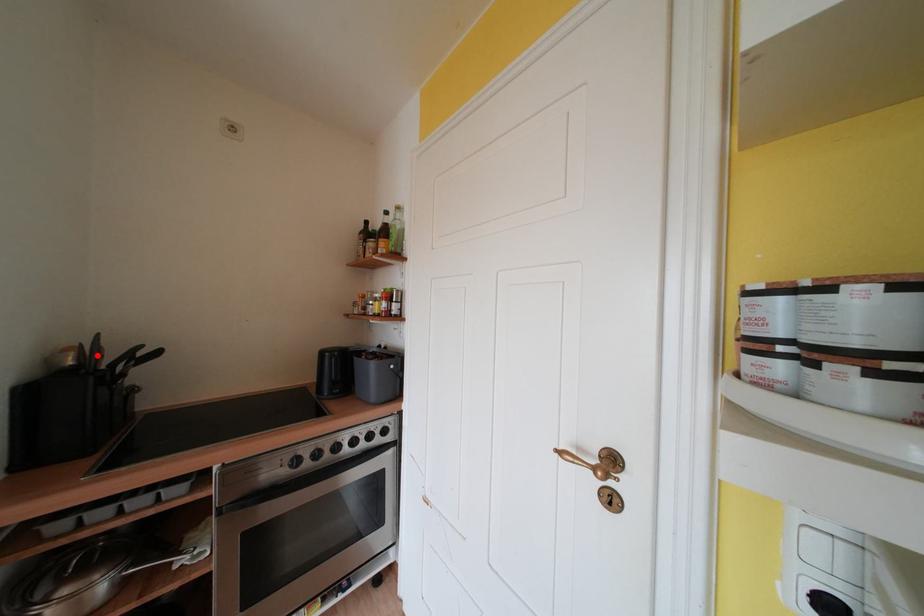
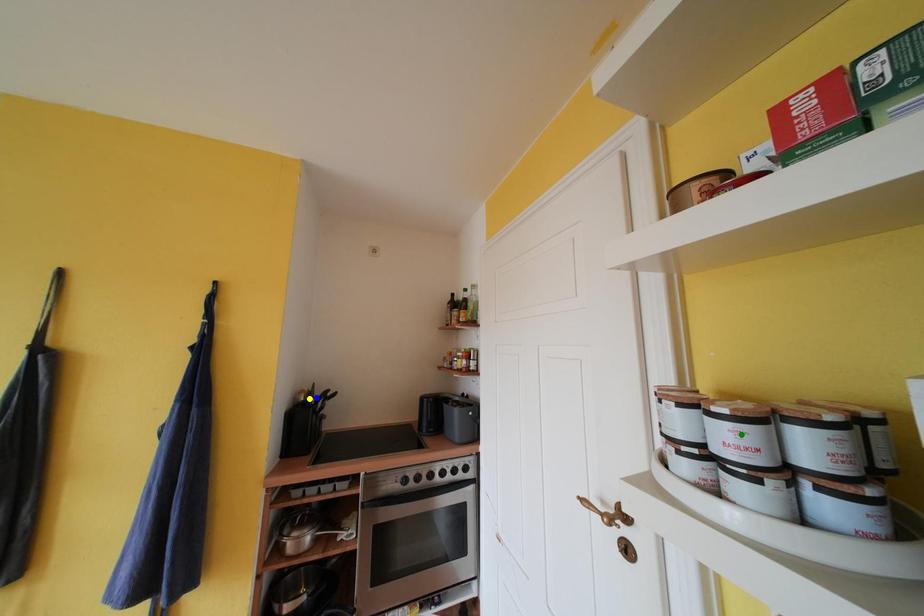
Question: I am providing you with two images of the same scene from different viewpoints. A red point is marked on the first image. You are given multiple points on the second image. Which point in image 2 is actually the same real-world point as the red point in image 1?

Choices:
 (A) yellow point
 (B) blue point
 (C) green point

Answer: (B)